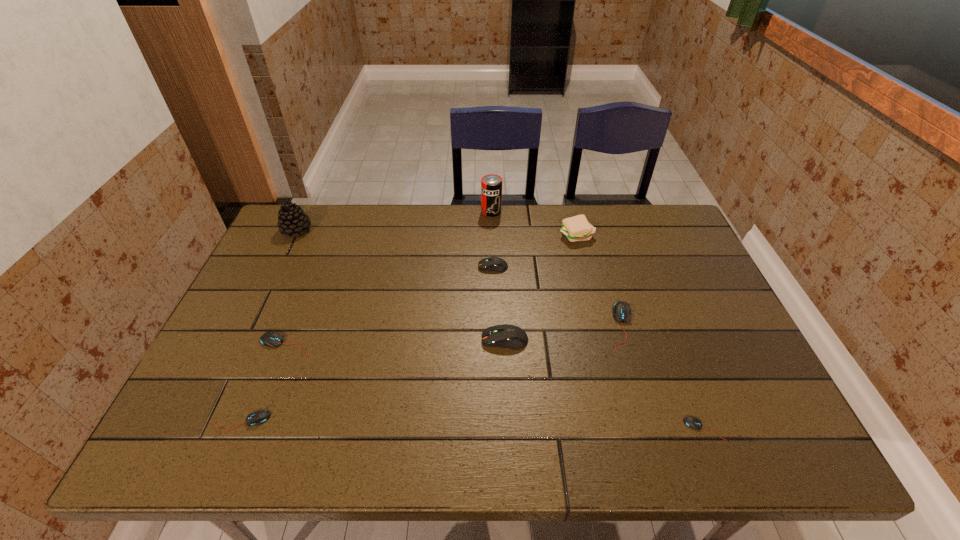
Identify the location of vacant space at the right edge of the desktop. The image size is (960, 540). (652, 267).

The width and height of the screenshot is (960, 540). In the image, there is a desktop. Identify the location of vacant space at the far left corner. (304, 246).

In the image, there is a desktop. What are the coordinates of `vacant space at the far right corner` in the screenshot? It's located at point(672,209).

Where is `unoccupied position between the fifth tallest mouse and the tallest mouse`? unoccupied position between the fifth tallest mouse and the tallest mouse is located at coordinates (373, 380).

The height and width of the screenshot is (540, 960). I want to click on empty space that is in between the fifth tallest object and the shortest mouse, so click(x=598, y=348).

Locate an element on the screen. This screenshot has width=960, height=540. free spot between the sixth tallest object and the seventh shortest object is located at coordinates (599, 281).

Where is `free area in between the farthest object and the third shortest object`? Image resolution: width=960 pixels, height=540 pixels. free area in between the farthest object and the third shortest object is located at coordinates (389, 278).

Find the location of a particular element. The height and width of the screenshot is (540, 960). vacant region between the third tallest object and the seventh tallest object is located at coordinates (431, 290).

This screenshot has width=960, height=540. Identify the location of free space between the patty and the second tallest mouse. (535, 251).

Find the location of a particular element. This screenshot has height=540, width=960. empty space that is in between the nearer dark computer equipment and the can is located at coordinates (498, 276).